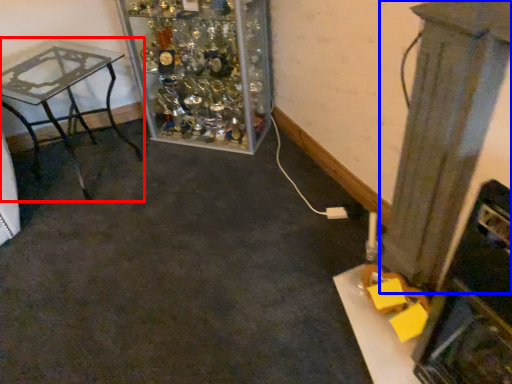
Question: Which object appears closest to the camera in this image, table (highlighted by a red box) or pillar (highlighted by a blue box)?

Choices:
 (A) table
 (B) pillar

Answer: (B)